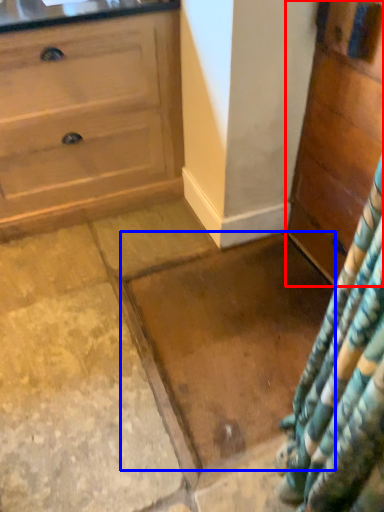
Question: Among these objects, which one is nearest to the camera, chest of drawers (highlighted by a red box) or granite (highlighted by a blue box)?

Choices:
 (A) chest of drawers
 (B) granite

Answer: (A)